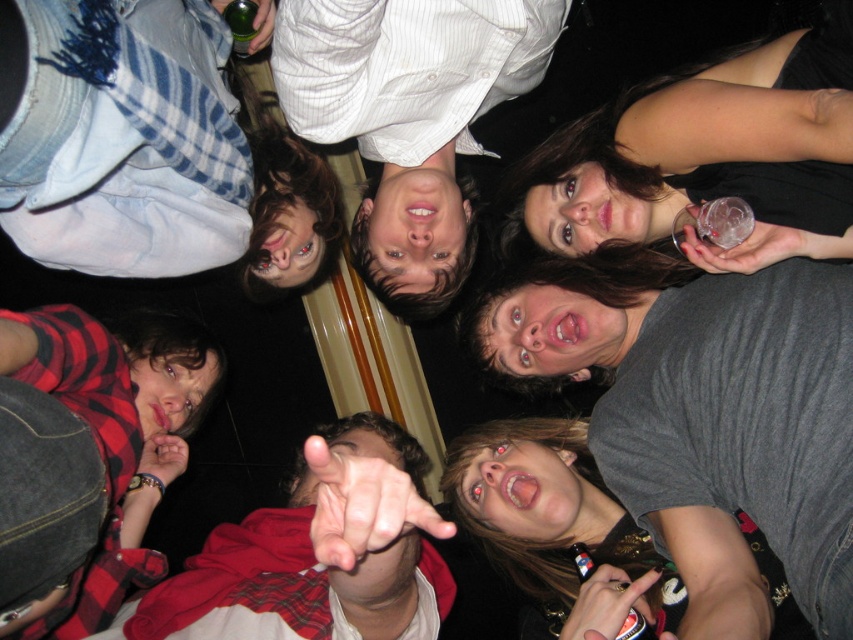
Can you confirm if plaid shirt at center is positioned to the left of matte gray shirt at lower right?

Correct, you'll find plaid shirt at center to the left of matte gray shirt at lower right.

Is point (440, 586) farther from viewer compared to point (809, 627)?

Yes, it is behind point (809, 627).

Describe the element at coordinates (293, 582) in the screenshot. The height and width of the screenshot is (640, 853). I see `plaid shirt at center` at that location.

Find the location of a particular element. plaid shirt at center is located at coordinates (293, 582).

Can you confirm if matte black dress at upper right is thinner than matte gray shirt at lower right?

Yes.

Is matte black dress at upper right to the left of matte gray shirt at lower right from the viewer's perspective?

Incorrect, matte black dress at upper right is not on the left side of matte gray shirt at lower right.

Does point (537, 189) come closer to viewer compared to point (553, 513)?

No, it is behind (553, 513).

Image resolution: width=853 pixels, height=640 pixels. Identify the location of matte black dress at upper right. (708, 156).

Which is in front, point (74, 64) or point (651, 541)?

Point (74, 64)

Looking at this image, who is shorter, denim jacket at upper left or matte gray shirt at lower right?

matte gray shirt at lower right is shorter.

Does point (306, 214) come farther from viewer compared to point (664, 620)?

Yes, point (306, 214) is farther from viewer.

You are a GUI agent. You are given a task and a screenshot of the screen. Output one action in this format:
    pyautogui.click(x=<x>, y=<y>)
    Task: Click on the denim jacket at upper left
    This screenshot has width=853, height=640.
    Given the screenshot: What is the action you would take?
    pyautogui.click(x=149, y=148)